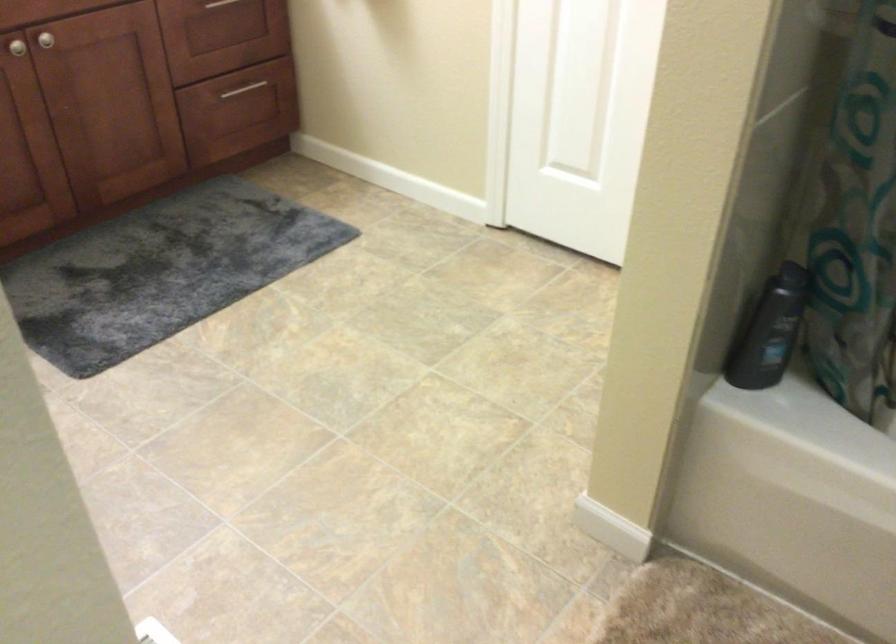
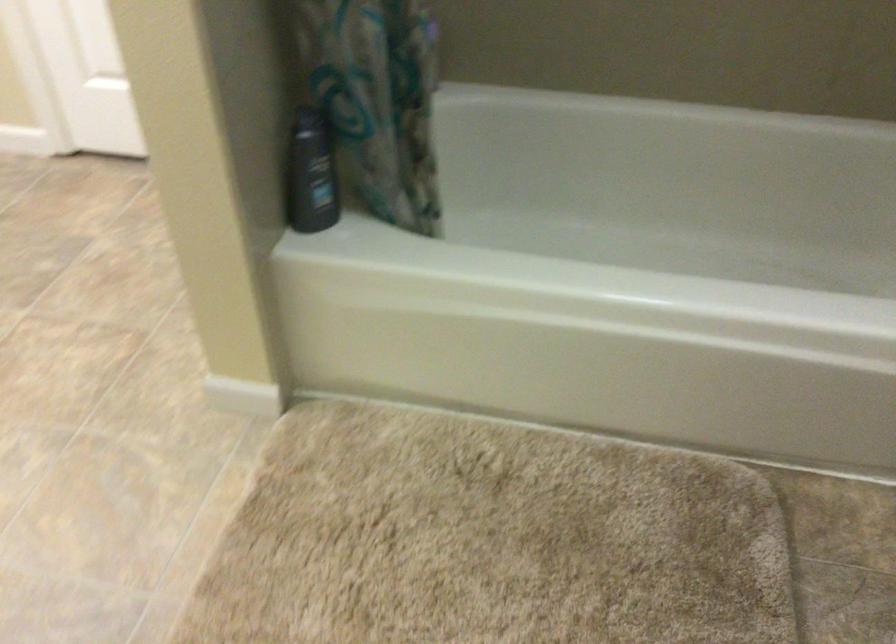
Where in the second image is the point corresponding to point (768, 330) from the first image?

(311, 174)